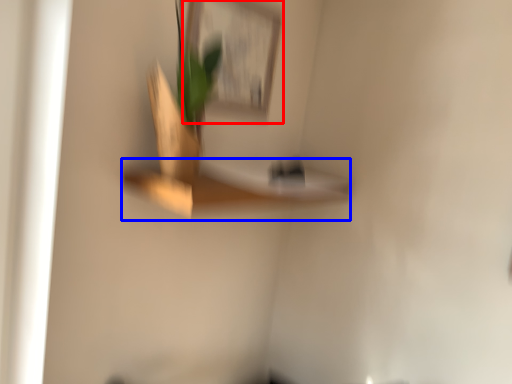
Question: Among these objects, which one is farthest to the camera, picture frame (highlighted by a red box) or shelf (highlighted by a blue box)?

Choices:
 (A) picture frame
 (B) shelf

Answer: (A)